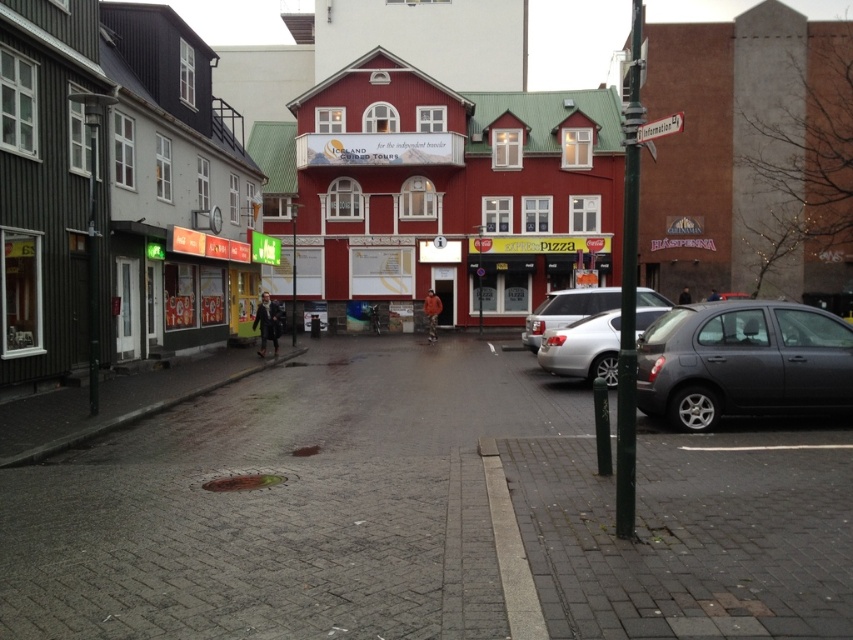
You are standing at the point marked as point (306,189) on the map of the town. What is the name of the landmark located at this specific coordinate?

The brick paved street at center is located at point (306,189).

You are a tourist standing on the brick paved street at center and want to enter the red painted building at center. Based on the scene description, which direction should you look to find the entrance?

The brick paved street at center is below the red painted building at center, so you should look upward to find the entrance.